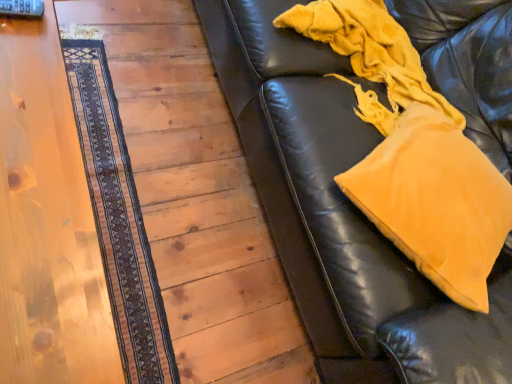
Question: Considering the relative sizes of wooden floor at lower left and velvety yellow blanket at right in the image provided, is wooden floor at lower left smaller than velvety yellow blanket at right?

Choices:
 (A) no
 (B) yes

Answer: (A)

Question: From a real-world perspective, is wooden floor at lower left below velvety yellow blanket at right?

Choices:
 (A) yes
 (B) no

Answer: (A)

Question: From the image's perspective, is wooden floor at lower left over velvety yellow blanket at right?

Choices:
 (A) no
 (B) yes

Answer: (A)

Question: Does wooden floor at lower left have a greater width compared to velvety yellow blanket at right?

Choices:
 (A) yes
 (B) no

Answer: (A)

Question: Does wooden floor at lower left have a lesser height compared to velvety yellow blanket at right?

Choices:
 (A) no
 (B) yes

Answer: (B)

Question: From the image's perspective, relative to wooden floor at lower left, is wooden table at left above or below?

Choices:
 (A) below
 (B) above

Answer: (A)

Question: Considering the positions of wooden table at left and wooden floor at lower left in the image, is wooden table at left bigger or smaller than wooden floor at lower left?

Choices:
 (A) big
 (B) small

Answer: (A)

Question: Is wooden table at left to the left or to the right of wooden floor at lower left in the image?

Choices:
 (A) left
 (B) right

Answer: (A)

Question: Relative to wooden floor at lower left, is wooden table at left in front or behind?

Choices:
 (A) front
 (B) behind

Answer: (A)

Question: Is point (39, 360) closer or farther from the camera than point (346, 79)?

Choices:
 (A) closer
 (B) farther

Answer: (A)

Question: Considering their positions, is wooden table at left located in front of or behind velvety yellow blanket at right?

Choices:
 (A) front
 (B) behind

Answer: (A)

Question: From the image's perspective, is wooden table at left located above or below velvety yellow blanket at right?

Choices:
 (A) below
 (B) above

Answer: (A)

Question: Is wooden table at left wider or thinner than velvety yellow blanket at right?

Choices:
 (A) wide
 (B) thin

Answer: (A)

Question: From a real-world perspective, is mustard yellow fabric pillow at upper right physically located above or below velvety yellow blanket at right?

Choices:
 (A) above
 (B) below

Answer: (A)

Question: Relative to velvety yellow blanket at right, is mustard yellow fabric pillow at upper right in front or behind?

Choices:
 (A) behind
 (B) front

Answer: (B)